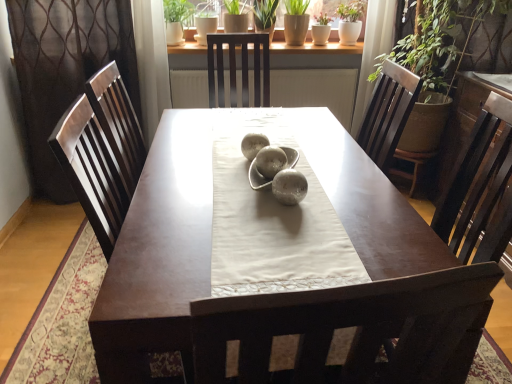
Question: In terms of size, does green matte plant at upper center, which ranks as the third plant in right-to-left order, appear bigger or smaller than brown textured curtain at left?

Choices:
 (A) small
 (B) big

Answer: (A)

Question: From the image's perspective, relative to brown textured curtain at left, is green matte plant at upper center, the first plant viewed from the left, above or below?

Choices:
 (A) below
 (B) above

Answer: (B)

Question: Considering the real-world distances, which object is farthest from the matte brown table at center?

Choices:
 (A) green matte plant at upper center, which appears as the first plant when viewed from the right
 (B) brown textured curtain at left
 (C) green matte plant at upper center, which ranks as the third plant in right-to-left order
 (D) green matte pot at upper center, marked as the 2th plant in a left-to-right arrangement

Answer: (D)

Question: Considering the real-world distances, which object is farthest from the matte brown table at center?

Choices:
 (A) green matte plant at upper center, which is the third plant in left-to-right order
 (B) brown textured curtain at left
 (C) green matte plant at upper center, which ranks as the third plant in right-to-left order
 (D) green matte pot at upper center, marked as the 2th plant in a left-to-right arrangement

Answer: (D)